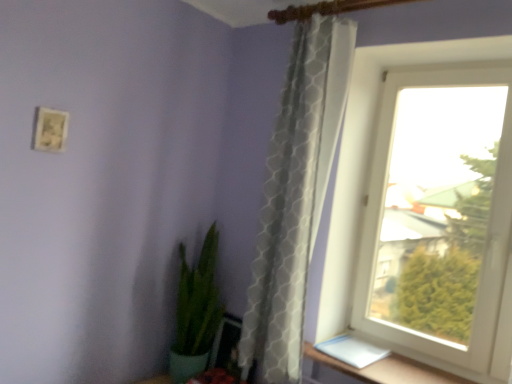
Question: Does brown wooden window sill at lower right have a greater height compared to white plastic window at upper right?

Choices:
 (A) yes
 (B) no

Answer: (B)

Question: Is brown wooden window sill at lower right not near white plastic window at upper right?

Choices:
 (A) no
 (B) yes

Answer: (A)

Question: Does brown wooden window sill at lower right lie in front of white plastic window at upper right?

Choices:
 (A) no
 (B) yes

Answer: (B)

Question: Does brown wooden window sill at lower right have a lesser width compared to white plastic window at upper right?

Choices:
 (A) no
 (B) yes

Answer: (A)

Question: Considering the relative sizes of brown wooden window sill at lower right and white plastic window at upper right in the image provided, is brown wooden window sill at lower right shorter than white plastic window at upper right?

Choices:
 (A) no
 (B) yes

Answer: (B)

Question: Are brown wooden window sill at lower right and white plastic window at upper right beside each other?

Choices:
 (A) yes
 (B) no

Answer: (B)

Question: From the image's perspective, would you say brown wooden window sill at lower right is shown under matte white picture frame at upper left?

Choices:
 (A) no
 (B) yes

Answer: (B)

Question: Does brown wooden window sill at lower right lie behind matte white picture frame at upper left?

Choices:
 (A) yes
 (B) no

Answer: (B)

Question: Is brown wooden window sill at lower right positioned beyond the bounds of matte white picture frame at upper left?

Choices:
 (A) yes
 (B) no

Answer: (A)

Question: Considering the relative sizes of brown wooden window sill at lower right and matte white picture frame at upper left in the image provided, is brown wooden window sill at lower right smaller than matte white picture frame at upper left?

Choices:
 (A) yes
 (B) no

Answer: (B)

Question: From a real-world perspective, is brown wooden window sill at lower right physically above matte white picture frame at upper left?

Choices:
 (A) no
 (B) yes

Answer: (A)

Question: Is brown wooden window sill at lower right far from matte white picture frame at upper left?

Choices:
 (A) no
 (B) yes

Answer: (B)

Question: Is white plastic window at upper right closer to camera compared to green glossy plant at lower left?

Choices:
 (A) no
 (B) yes

Answer: (B)